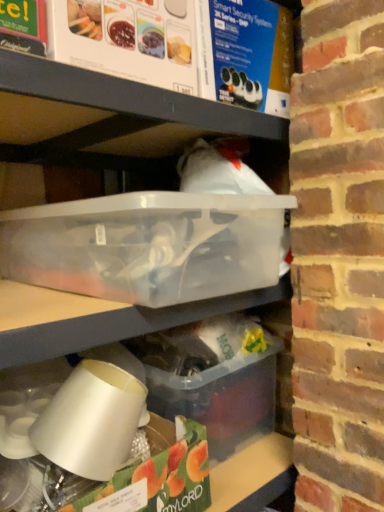
Locate an element on the screen. Image resolution: width=384 pixels, height=512 pixels. transparent plastic container at center, the 2th box from the bottom is located at coordinates (147, 245).

Image resolution: width=384 pixels, height=512 pixels. What do you see at coordinates (147, 245) in the screenshot?
I see `transparent plastic container at center, the 2th box from the bottom` at bounding box center [147, 245].

You are a GUI agent. You are given a task and a screenshot of the screen. Output one action in this format:
    pyautogui.click(x=<x>, y=<y>)
    Task: Click on the translucent plastic container at lower center, the first box when ordered from bottom to top
    Image resolution: width=384 pixels, height=512 pixels.
    Given the screenshot: What is the action you would take?
    pyautogui.click(x=212, y=378)

The image size is (384, 512). Describe the element at coordinates (212, 378) in the screenshot. I see `translucent plastic container at lower center, which is counted as the second box, starting from the top` at that location.

Image resolution: width=384 pixels, height=512 pixels. I want to click on transparent plastic container at center, the 1th box when ordered from top to bottom, so [147, 245].

Considering the positions of objects translucent plastic container at lower center, which is counted as the second box, starting from the top, and transparent plastic container at center, the 1th box when ordered from top to bottom, in the image provided, who is more to the left, translucent plastic container at lower center, which is counted as the second box, starting from the top, or transparent plastic container at center, the 1th box when ordered from top to bottom,?

transparent plastic container at center, the 1th box when ordered from top to bottom.

Relative to transparent plastic container at center, the 2th box from the bottom, is translucent plastic container at lower center, the first box when ordered from bottom to top, in front or behind?

Visually, translucent plastic container at lower center, the first box when ordered from bottom to top, is located behind transparent plastic container at center, the 2th box from the bottom.

Considering the points (219, 384) and (29, 237), which point is in front, point (219, 384) or point (29, 237)?

The point (29, 237) is in front.

From the image's perspective, relative to transparent plastic container at center, the 1th box when ordered from top to bottom, is translucent plastic container at lower center, the first box when ordered from bottom to top, above or below?

Based on their image positions, translucent plastic container at lower center, the first box when ordered from bottom to top, is located beneath transparent plastic container at center, the 1th box when ordered from top to bottom.

From a real-world perspective, is translucent plastic container at lower center, which is counted as the second box, starting from the top, located higher than transparent plastic container at center, the 1th box when ordered from top to bottom?

Actually, translucent plastic container at lower center, which is counted as the second box, starting from the top, is physically below transparent plastic container at center, the 1th box when ordered from top to bottom, in the real world.

Does translucent plastic container at lower center, which is counted as the second box, starting from the top, have a greater width compared to transparent plastic container at center, the 1th box when ordered from top to bottom?

In fact, translucent plastic container at lower center, which is counted as the second box, starting from the top, might be narrower than transparent plastic container at center, the 1th box when ordered from top to bottom.

Who is shorter, translucent plastic container at lower center, the first box when ordered from bottom to top, or transparent plastic container at center, the 1th box when ordered from top to bottom?

transparent plastic container at center, the 1th box when ordered from top to bottom.

Considering the sizes of objects translucent plastic container at lower center, which is counted as the second box, starting from the top, and transparent plastic container at center, the 1th box when ordered from top to bottom, in the image provided, who is bigger, translucent plastic container at lower center, which is counted as the second box, starting from the top, or transparent plastic container at center, the 1th box when ordered from top to bottom,?

Bigger between the two is transparent plastic container at center, the 1th box when ordered from top to bottom.

Is translucent plastic container at lower center, the first box when ordered from bottom to top, not inside transparent plastic container at center, the 1th box when ordered from top to bottom?

translucent plastic container at lower center, the first box when ordered from bottom to top, lies outside transparent plastic container at center, the 1th box when ordered from top to bottom,'s area.

Is translucent plastic container at lower center, the first box when ordered from bottom to top, facing towards transparent plastic container at center, the 1th box when ordered from top to bottom?

No.

Can you tell me how much translucent plastic container at lower center, which is counted as the second box, starting from the top, and transparent plastic container at center, the 1th box when ordered from top to bottom, differ in facing direction?

translucent plastic container at lower center, which is counted as the second box, starting from the top, and transparent plastic container at center, the 1th box when ordered from top to bottom, are facing 6.52 degrees away from each other.

Based on the photo, how far apart are translucent plastic container at lower center, the first box when ordered from bottom to top, and transparent plastic container at center, the 2th box from the bottom?

translucent plastic container at lower center, the first box when ordered from bottom to top, and transparent plastic container at center, the 2th box from the bottom, are 13.50 inches apart from each other.

Where is `box to the right of transparent plastic container at center, the 2th box from the bottom`? Image resolution: width=384 pixels, height=512 pixels. box to the right of transparent plastic container at center, the 2th box from the bottom is located at coordinates (212, 378).

Is transparent plastic container at center, the 2th box from the bottom, at the left side of translucent plastic container at lower center, which is counted as the second box, starting from the top?

Yes.

Is transparent plastic container at center, the 1th box when ordered from top to bottom, positioned behind translucent plastic container at lower center, the first box when ordered from bottom to top?

No, the depth of transparent plastic container at center, the 1th box when ordered from top to bottom, is less than that of translucent plastic container at lower center, the first box when ordered from bottom to top.

Does point (271, 249) come farther from viewer compared to point (149, 356)?

No, it is not.

From the image's perspective, which one is positioned lower, transparent plastic container at center, the 1th box when ordered from top to bottom, or translucent plastic container at lower center, which is counted as the second box, starting from the top?

translucent plastic container at lower center, which is counted as the second box, starting from the top, appears lower in the image.

From a real-world perspective, between transparent plastic container at center, the 2th box from the bottom, and translucent plastic container at lower center, the first box when ordered from bottom to top, who is vertically higher?

From a 3D spatial view, transparent plastic container at center, the 2th box from the bottom, is above.

Is transparent plastic container at center, the 2th box from the bottom, thinner than translucent plastic container at lower center, which is counted as the second box, starting from the top?

In fact, transparent plastic container at center, the 2th box from the bottom, might be wider than translucent plastic container at lower center, which is counted as the second box, starting from the top.

Is transparent plastic container at center, the 2th box from the bottom, taller or shorter than translucent plastic container at lower center, the first box when ordered from bottom to top?

Clearly, transparent plastic container at center, the 2th box from the bottom, is shorter compared to translucent plastic container at lower center, the first box when ordered from bottom to top.

Which of these two, transparent plastic container at center, the 2th box from the bottom, or translucent plastic container at lower center, the first box when ordered from bottom to top, is bigger?

With larger size is transparent plastic container at center, the 2th box from the bottom.

Is transparent plastic container at center, the 2th box from the bottom, not inside translucent plastic container at lower center, which is counted as the second box, starting from the top?

transparent plastic container at center, the 2th box from the bottom, is positioned outside translucent plastic container at lower center, which is counted as the second box, starting from the top.

Is transparent plastic container at center, the 2th box from the bottom, in contact with translucent plastic container at lower center, which is counted as the second box, starting from the top?

No, transparent plastic container at center, the 2th box from the bottom, is not next to translucent plastic container at lower center, which is counted as the second box, starting from the top.

Is transparent plastic container at center, the 1th box when ordered from top to bottom, positioned with its back to translucent plastic container at lower center, which is counted as the second box, starting from the top?

No, translucent plastic container at lower center, which is counted as the second box, starting from the top, is not at the back of transparent plastic container at center, the 1th box when ordered from top to bottom.

How distant is transparent plastic container at center, the 2th box from the bottom, from translucent plastic container at lower center, which is counted as the second box, starting from the top?

transparent plastic container at center, the 2th box from the bottom, is 13.50 inches away from translucent plastic container at lower center, which is counted as the second box, starting from the top.

Where is `box that appears on the left of translucent plastic container at lower center, which is counted as the second box, starting from the top`? This screenshot has width=384, height=512. box that appears on the left of translucent plastic container at lower center, which is counted as the second box, starting from the top is located at coordinates (147, 245).

Locate an element on the screen. box on the left of translucent plastic container at lower center, the first box when ordered from bottom to top is located at coordinates (147, 245).

Locate an element on the screen. This screenshot has height=512, width=384. box below the transparent plastic container at center, the 2th box from the bottom (from the image's perspective) is located at coordinates (212, 378).